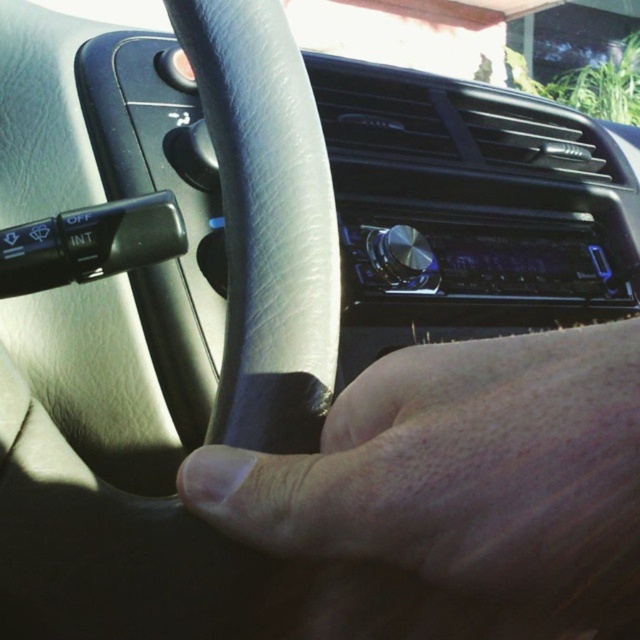
You are a passenger in the car and want to adjust the volume using the silver knob on the stereo. Which object, the leather at center or the gray leather steering wheel at center, is closer to your hand if you reach down from the passenger seat?

The leather at center is closer to your hand because it is located below the gray leather steering wheel at center, so it would be lower and more accessible from the passenger seat.